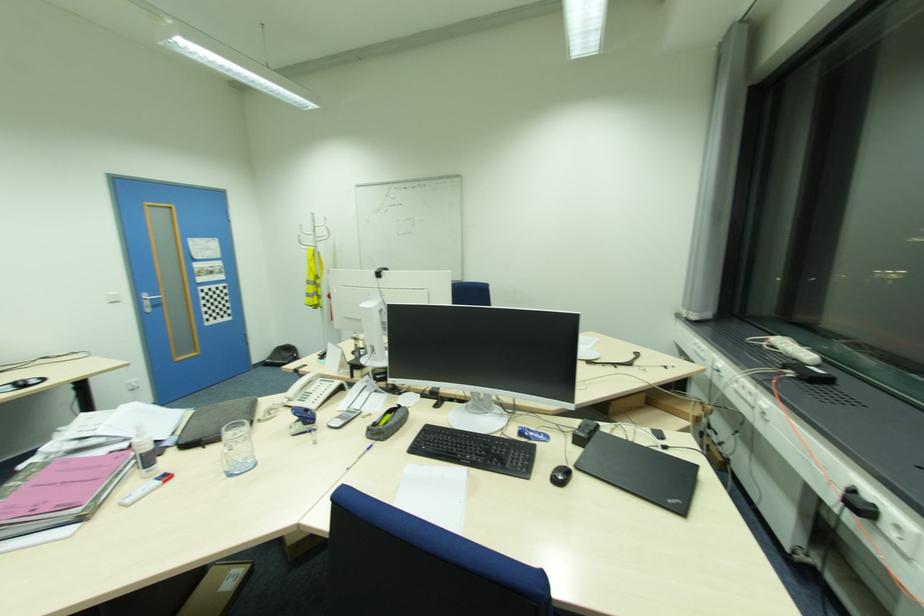
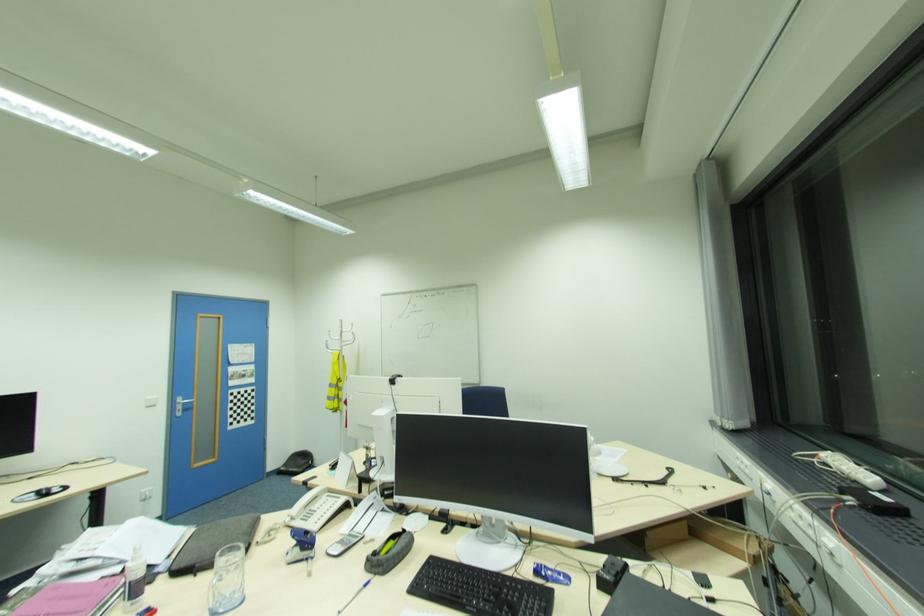
Where in the second image is the point corresponding to [289,398] from the first image?

(292, 516)